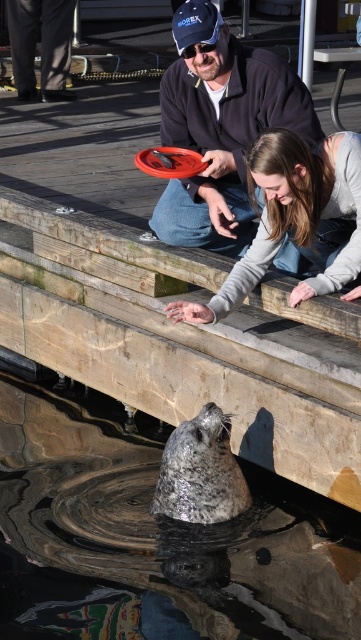
Question: Is grayish water at seal center smaller than smooth gray seal at lower center?

Choices:
 (A) no
 (B) yes

Answer: (A)

Question: Among these objects, which one is nearest to the camera?

Choices:
 (A) grayish water at seal center
 (B) wooden at center

Answer: (A)

Question: Is wooden at center further to the viewer compared to matte black pants at upper left?

Choices:
 (A) yes
 (B) no

Answer: (B)

Question: Does gray fur seal at center have a greater width compared to orange matte frisbee at center?

Choices:
 (A) no
 (B) yes

Answer: (B)

Question: Which object is positioned farthest from the grayish water at seal center?

Choices:
 (A) matte black pants at upper left
 (B) smooth gray seal at lower center
 (C) orange matte frisbee at center

Answer: (A)

Question: Which object is farther from the camera taking this photo?

Choices:
 (A) matte black frisbee at upper center
 (B) matte black pants at upper left
 (C) gray fur seal at center

Answer: (B)